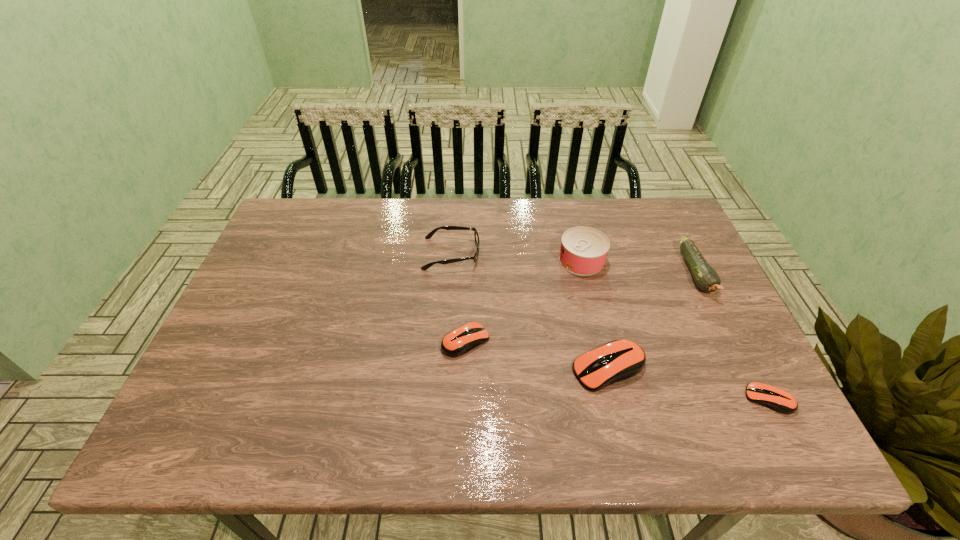
Locate an element on the screen. This screenshot has width=960, height=540. vacant space located 0.240m on the back of the shortest computer mouse is located at coordinates (720, 305).

I want to click on vacant space located 0.130m at the blossom end of the zucchini, so click(x=730, y=341).

The width and height of the screenshot is (960, 540). Find the location of `free location located 0.200m on the front-facing side of the spectacles`. free location located 0.200m on the front-facing side of the spectacles is located at coordinates (547, 254).

This screenshot has height=540, width=960. I want to click on free space located on the left of the tallest object, so click(x=517, y=260).

At what (x,y) coordinates should I click in order to perform the action: click on object located in the far edge section of the desktop. Please return your answer as a coordinate pair (x, y). This screenshot has width=960, height=540. Looking at the image, I should click on (476, 236).

Find the location of a particular element. computer mouse that is at the right edge is located at coordinates (776, 399).

Locate an element on the screen. The width and height of the screenshot is (960, 540). zucchini located in the right edge section of the desktop is located at coordinates (706, 278).

Where is `object present at the near right corner`? object present at the near right corner is located at coordinates (776, 399).

Find the location of `vacant region at the far edge of the desktop`. vacant region at the far edge of the desktop is located at coordinates (495, 212).

You are a GUI agent. You are given a task and a screenshot of the screen. Output one action in this format:
    pyautogui.click(x=<x>, y=<y>)
    Task: Click on the free space at the near edge
    
    Given the screenshot: What is the action you would take?
    pyautogui.click(x=439, y=388)